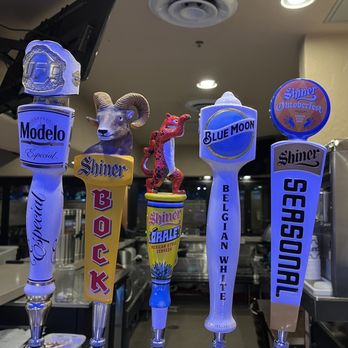
This screenshot has width=348, height=348. In order to click on beer tap handles in this screenshot , I will do `click(50, 208)`, `click(114, 210)`, `click(166, 224)`, `click(231, 223)`, `click(287, 204)`.